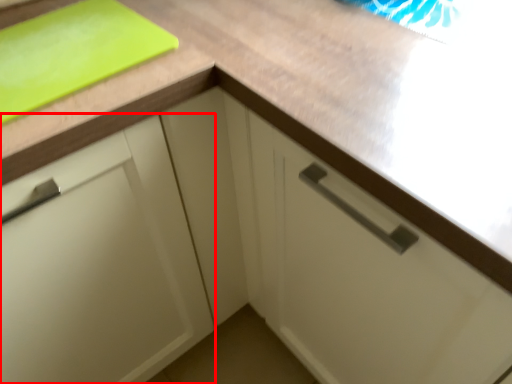
Question: From the image's perspective, what is the correct spatial relationship of cabinetry (annotated by the red box) in relation to cutting board?

Choices:
 (A) below
 (B) above

Answer: (A)